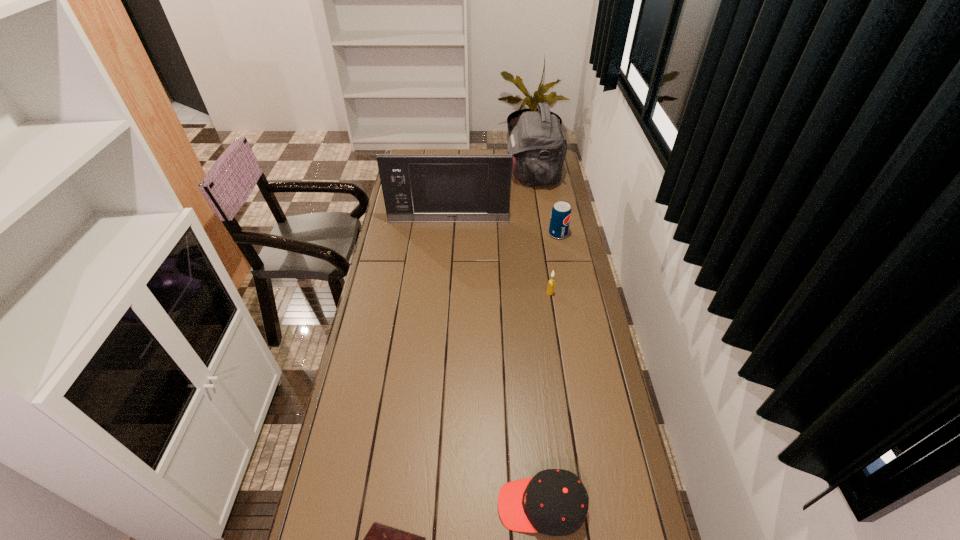
Where is `cap that is at the right edge`? The width and height of the screenshot is (960, 540). cap that is at the right edge is located at coordinates (554, 502).

Locate an element on the screen. Image resolution: width=960 pixels, height=540 pixels. object at the far right corner is located at coordinates (539, 146).

Where is `vacant region at the far edge of the desktop`? The image size is (960, 540). vacant region at the far edge of the desktop is located at coordinates (461, 150).

Locate an element on the screen. This screenshot has width=960, height=540. free space at the left edge is located at coordinates pos(385,335).

Identify the location of vacant space at the right edge. The image size is (960, 540). (554, 267).

The width and height of the screenshot is (960, 540). Find the location of `vacant space at the far left corner`. vacant space at the far left corner is located at coordinates (410, 152).

The height and width of the screenshot is (540, 960). In order to click on free spot between the shoulder bag and the cap in this screenshot , I will do `click(538, 341)`.

At what (x,y) coordinates should I click in order to perform the action: click on blank region between the microwave oven and the fourth farthest object. Please return your answer as a coordinate pair (x, y). This screenshot has width=960, height=540. Looking at the image, I should click on (499, 257).

Identify the location of unoccupied position between the second shortest object and the microwave oven. (495, 363).

Find the location of `vacant region between the candle and the pop`. vacant region between the candle and the pop is located at coordinates (554, 264).